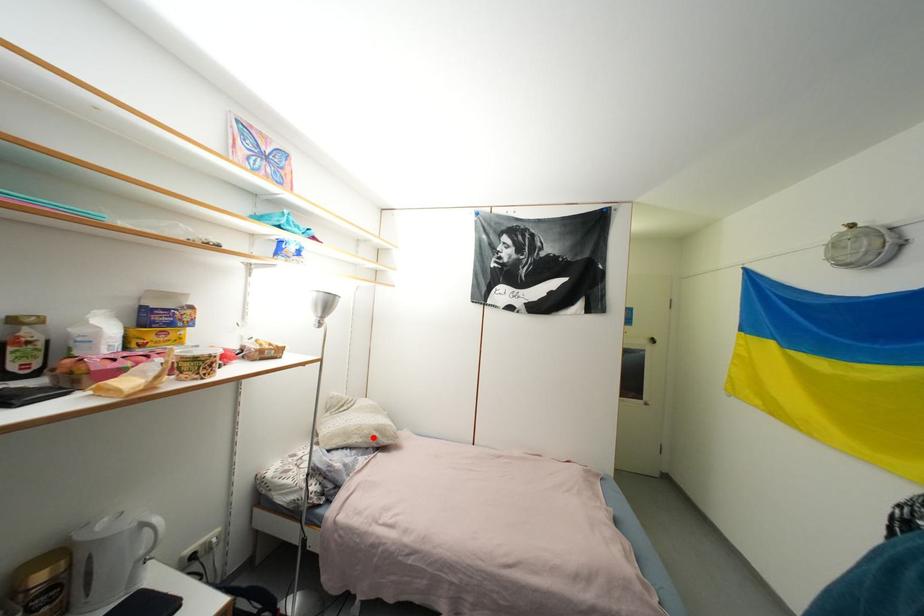
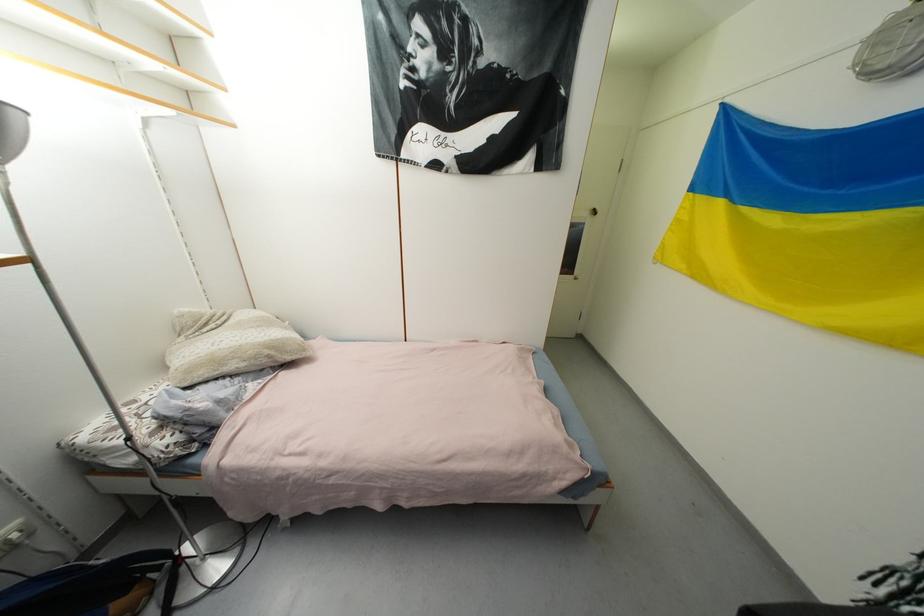
Locate, in the second image, the point that corresponds to the highlighted location in the first image.

(261, 359)